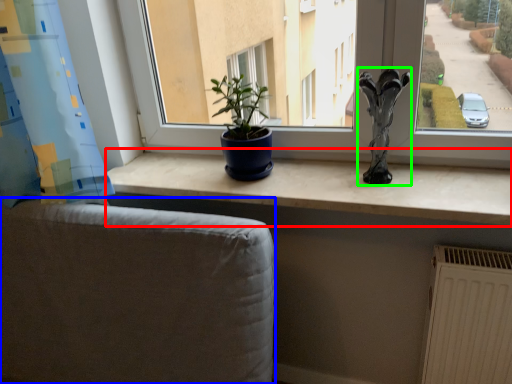
Question: Estimate the real-world distances between objects in this image. Which object is closer to counter top (highlighted by a red box), armchair (highlighted by a blue box) or sculpture (highlighted by a green box)?

Choices:
 (A) armchair
 (B) sculpture

Answer: (B)